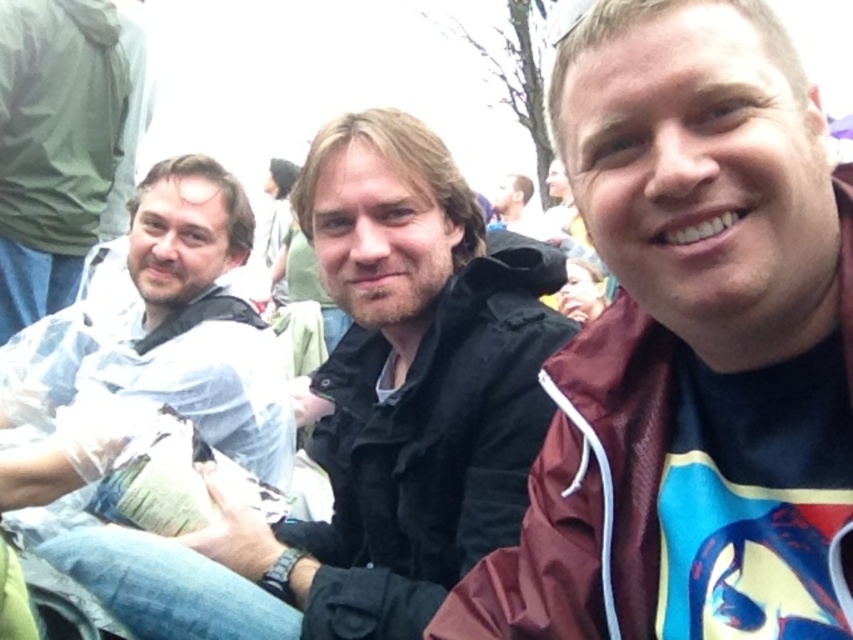
You are standing in the crowd at the event and want to find the person wearing the maroon fabric jacket at right. Based on their location coordinates, which direction should you look to locate them?

The maroon fabric jacket at right is located at coordinates point [689,346], which is to the right side of the image. Look towards the right side of the crowd to find them.

You are a photographer trying to capture a clear shot of the maroon fabric jacket at right without the white plastic bag at left blocking it. Based on the scene, can you position yourself in a way to avoid the bag obstructing the jacket?

The maroon fabric jacket at right is in front of the white plastic bag at left, so the bag is already behind the jacket. Therefore, you cannot avoid the bag obstructing the jacket because the jacket is closer to the camera and the bag is behind it.